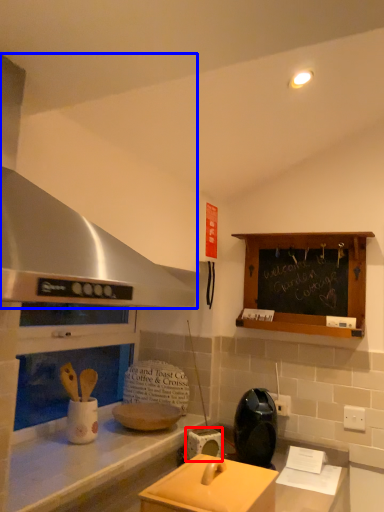
Question: Among these objects, which one is nearest to the camera, appliance (highlighted by a red box) or exhaust hood (highlighted by a blue box)?

Choices:
 (A) appliance
 (B) exhaust hood

Answer: (B)